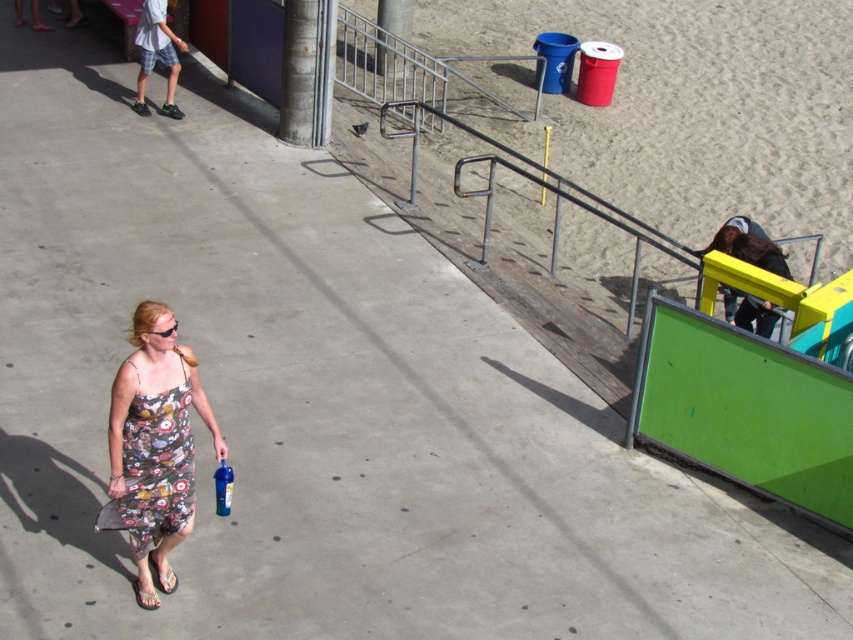
Question: Is the position of floral print fabric dress at lower left less distant than that of plaid shorts at upper left?

Choices:
 (A) no
 (B) yes

Answer: (B)

Question: Can you confirm if floral print fabric dress at lower left is positioned above plaid shorts at upper left?

Choices:
 (A) no
 (B) yes

Answer: (A)

Question: Observing the image, what is the correct spatial positioning of floral print fabric dress at lower left in reference to plaid shorts at upper left?

Choices:
 (A) left
 (B) right

Answer: (B)